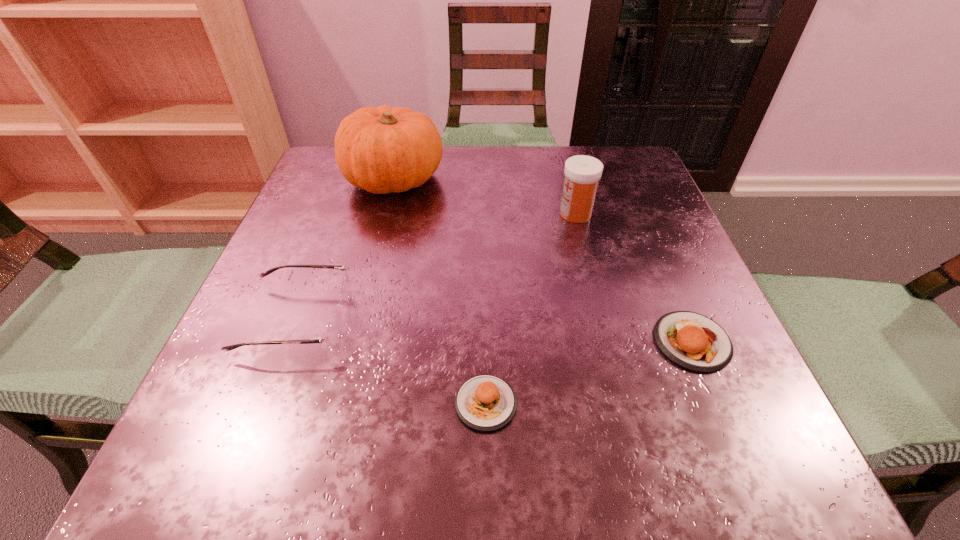
The image size is (960, 540). Find the location of `vacant area that satisfies the following two spatial constraints: 1. on the front-facing side of the taller food; 2. on the left side of the third tallest object`. vacant area that satisfies the following two spatial constraints: 1. on the front-facing side of the taller food; 2. on the left side of the third tallest object is located at coordinates (290, 341).

The image size is (960, 540). Find the location of `free space that satisfies the following two spatial constraints: 1. on the back side of the nearer food; 2. on the front-facing side of the spectacles`. free space that satisfies the following two spatial constraints: 1. on the back side of the nearer food; 2. on the front-facing side of the spectacles is located at coordinates (485, 320).

The width and height of the screenshot is (960, 540). I want to click on free space that satisfies the following two spatial constraints: 1. on the front side of the medicine; 2. on the right side of the pumpkin, so click(x=385, y=213).